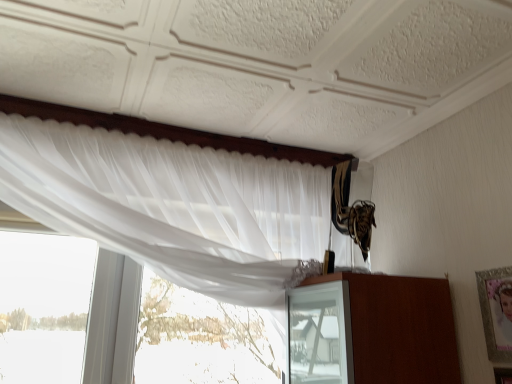
The height and width of the screenshot is (384, 512). In order to click on white sheer curtain at upper left in this screenshot , I will do `click(173, 206)`.

The width and height of the screenshot is (512, 384). Describe the element at coordinates (173, 206) in the screenshot. I see `white sheer curtain at upper left` at that location.

Where is `silver metallic picture frame at upper right`? silver metallic picture frame at upper right is located at coordinates (496, 311).

Describe the element at coordinates (496, 311) in the screenshot. This screenshot has width=512, height=384. I see `silver metallic picture frame at upper right` at that location.

Identify the location of white sheer curtain at upper left. coord(173,206).

Would you say silver metallic picture frame at upper right is to the left or to the right of white sheer curtain at upper left in the picture?

silver metallic picture frame at upper right is positioned on white sheer curtain at upper left's right side.

Does silver metallic picture frame at upper right lie in front of white sheer curtain at upper left?

No, the depth of silver metallic picture frame at upper right is greater than that of white sheer curtain at upper left.

Is point (486, 336) closer to camera compared to point (123, 204)?

Yes, it is.

In the scene shown: From the image's perspective, is silver metallic picture frame at upper right positioned above or below white sheer curtain at upper left?

Based on their image positions, silver metallic picture frame at upper right is located beneath white sheer curtain at upper left.

In the scene shown: From a real-world perspective, which is physically above, silver metallic picture frame at upper right or white sheer curtain at upper left?

In real-world perspective, white sheer curtain at upper left is above.

Can you confirm if silver metallic picture frame at upper right is wider than white sheer curtain at upper left?

In fact, silver metallic picture frame at upper right might be narrower than white sheer curtain at upper left.

Can you confirm if silver metallic picture frame at upper right is shorter than white sheer curtain at upper left?

Yes.

Considering the relative sizes of silver metallic picture frame at upper right and white sheer curtain at upper left in the image provided, is silver metallic picture frame at upper right smaller than white sheer curtain at upper left?

Yes, silver metallic picture frame at upper right is smaller than white sheer curtain at upper left.

Is white sheer curtain at upper left surrounded by silver metallic picture frame at upper right?

That's incorrect, white sheer curtain at upper left is not inside silver metallic picture frame at upper right.

Is silver metallic picture frame at upper right in contact with white sheer curtain at upper left?

No, silver metallic picture frame at upper right is not beside white sheer curtain at upper left.

Is silver metallic picture frame at upper right oriented away from white sheer curtain at upper left?

No, silver metallic picture frame at upper right's orientation is not away from white sheer curtain at upper left.

Identify the location of picture frame that appears behind the white sheer curtain at upper left. This screenshot has width=512, height=384. (496, 311).

Is white sheer curtain at upper left to the right of silver metallic picture frame at upper right from the viewer's perspective?

In fact, white sheer curtain at upper left is to the left of silver metallic picture frame at upper right.

Is white sheer curtain at upper left positioned behind silver metallic picture frame at upper right?

No, it is not.

Is point (159, 185) positioned before point (495, 332)?

That is False.

From the image's perspective, does white sheer curtain at upper left appear higher than silver metallic picture frame at upper right?

Yes.

Consider the image. From a real-world perspective, between white sheer curtain at upper left and silver metallic picture frame at upper right, who is vertically lower?

silver metallic picture frame at upper right, from a real-world perspective.

Looking at this image, between white sheer curtain at upper left and silver metallic picture frame at upper right, which one has larger width?

white sheer curtain at upper left is wider.

Considering the sizes of objects white sheer curtain at upper left and silver metallic picture frame at upper right in the image provided, who is taller, white sheer curtain at upper left or silver metallic picture frame at upper right?

white sheer curtain at upper left is taller.

Based on the photo, is white sheer curtain at upper left bigger than silver metallic picture frame at upper right?

Yes.

Choose the correct answer: Is white sheer curtain at upper left inside silver metallic picture frame at upper right or outside it?

white sheer curtain at upper left is not inside silver metallic picture frame at upper right, it's outside.

Is white sheer curtain at upper left far from silver metallic picture frame at upper right?

Actually, white sheer curtain at upper left and silver metallic picture frame at upper right are a little close together.

Is white sheer curtain at upper left facing away from silver metallic picture frame at upper right?

white sheer curtain at upper left is not turned away from silver metallic picture frame at upper right.

Can you tell me how much white sheer curtain at upper left and silver metallic picture frame at upper right differ in facing direction?

91.5 degrees separate the facing orientations of white sheer curtain at upper left and silver metallic picture frame at upper right.

Where is `curtain to the left of silver metallic picture frame at upper right`? The width and height of the screenshot is (512, 384). curtain to the left of silver metallic picture frame at upper right is located at coordinates (173, 206).

The height and width of the screenshot is (384, 512). In order to click on picture frame below the white sheer curtain at upper left (from a real-world perspective) in this screenshot , I will do `click(496, 311)`.

At what (x,y) coordinates should I click in order to perform the action: click on picture frame behind the white sheer curtain at upper left. Please return your answer as a coordinate pair (x, y). Looking at the image, I should click on (496, 311).